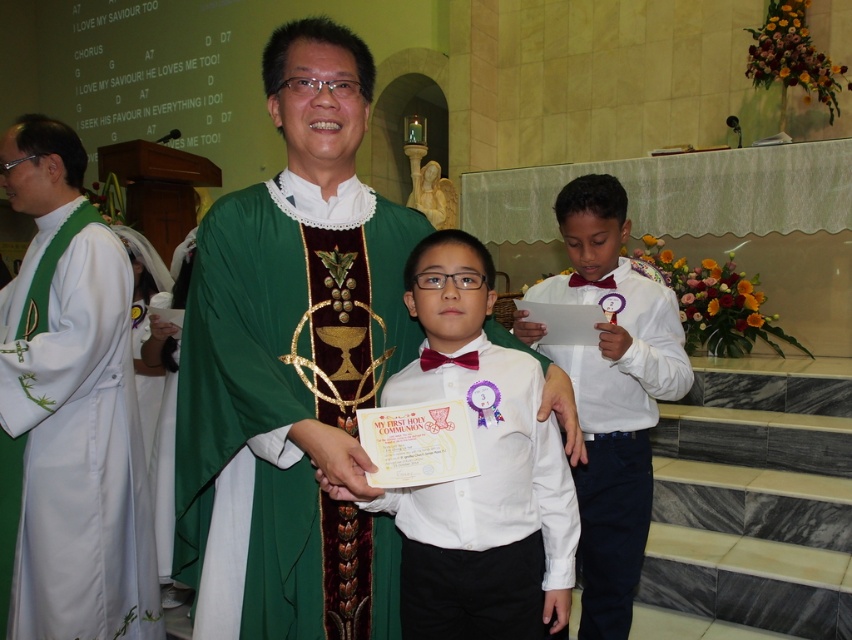
You are an event photographer at the ceremony. You need to position your camera to capture both the green satin robe at center and the white satin robe at right in the same frame. Based on their positions, which robe should be placed higher in your camera view to include both?

The green satin robe at center is located above the white satin robe at right, so to include both in the frame, the camera should position the green satin robe at center higher in the view.

You are a photographer positioned in the front row of the ceremony. You need to take a photo of both the white silk robe at left and the white glossy shirt at center. Which object should you focus on first to ensure both are in the frame?

You should focus on the white silk robe at left first because it is closer to you than the white glossy shirt at center, ensuring both are in the frame.